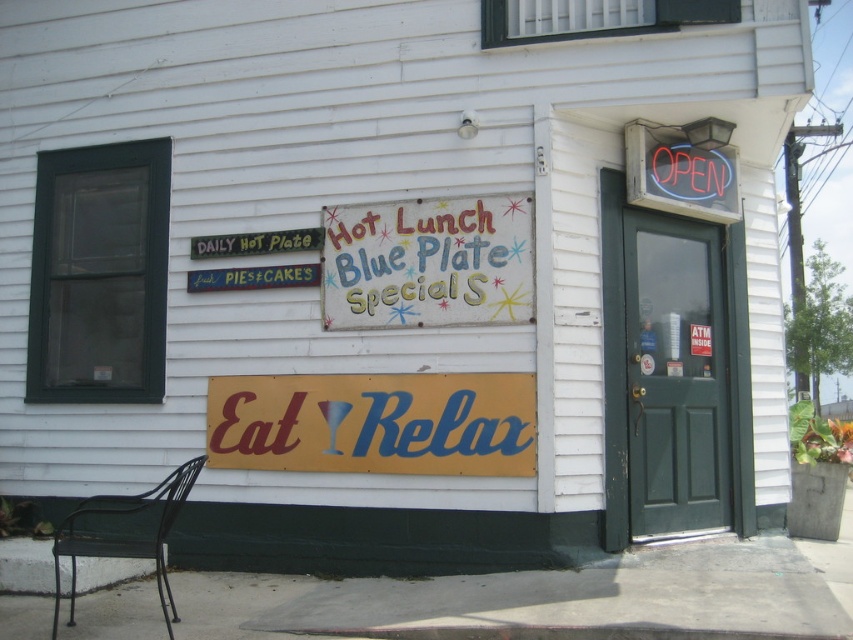
Question: Which object is farther from the camera taking this photo?

Choices:
 (A) painted wood signboard at center
 (B) yellow matte sign at center
 (C) black wrought iron chair at lower left

Answer: (A)

Question: Does painted wood signboard at center lie in front of black wrought iron chair at lower left?

Choices:
 (A) no
 (B) yes

Answer: (A)

Question: Is yellow matte sign at center positioned behind black wrought iron chair at lower left?

Choices:
 (A) no
 (B) yes

Answer: (B)

Question: Can you confirm if painted wood signboard at center is bigger than black wrought iron chair at lower left?

Choices:
 (A) no
 (B) yes

Answer: (A)

Question: Which object appears closest to the camera in this image?

Choices:
 (A) black wrought iron chair at lower left
 (B) painted wood signboard at center

Answer: (A)

Question: Considering the real-world distances, which object is closest to the painted wood signboard at center?

Choices:
 (A) yellow matte sign at center
 (B) black wrought iron chair at lower left

Answer: (A)